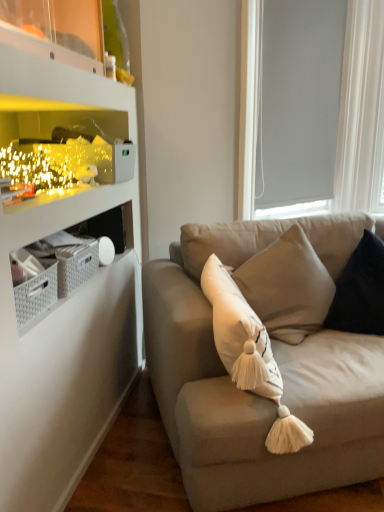
Question: In terms of width, does dark blue velvet pillow at right look wider or thinner when compared to white matte window screen at upper right?

Choices:
 (A) thin
 (B) wide

Answer: (B)

Question: Visually, is dark blue velvet pillow at right positioned to the left or to the right of white matte window screen at upper right?

Choices:
 (A) right
 (B) left

Answer: (A)

Question: Which is farther from the white matte window screen at upper right?

Choices:
 (A) dark blue velvet pillow at right
 (B) suede beige couch at center

Answer: (B)

Question: Which is nearer to the suede beige couch at center?

Choices:
 (A) dark blue velvet pillow at right
 (B) white matte window screen at upper right

Answer: (A)